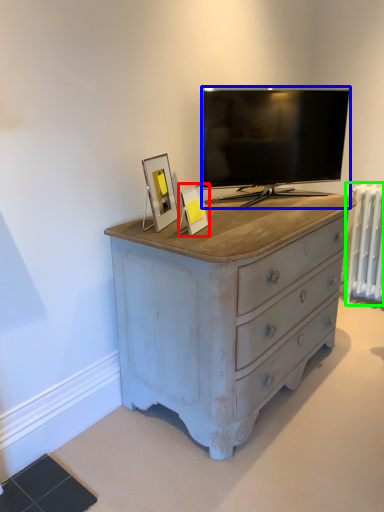
Question: Estimate the real-world distances between objects in this image. Which object is closer to picture frame (highlighted by a red box), television (highlighted by a blue box) or radiator (highlighted by a green box)?

Choices:
 (A) television
 (B) radiator

Answer: (A)